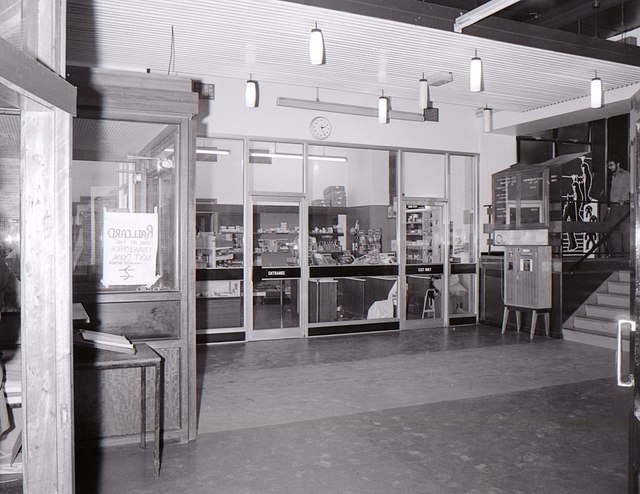
Image resolution: width=640 pixels, height=494 pixels. I want to click on window, so click(x=224, y=195), click(x=356, y=198).